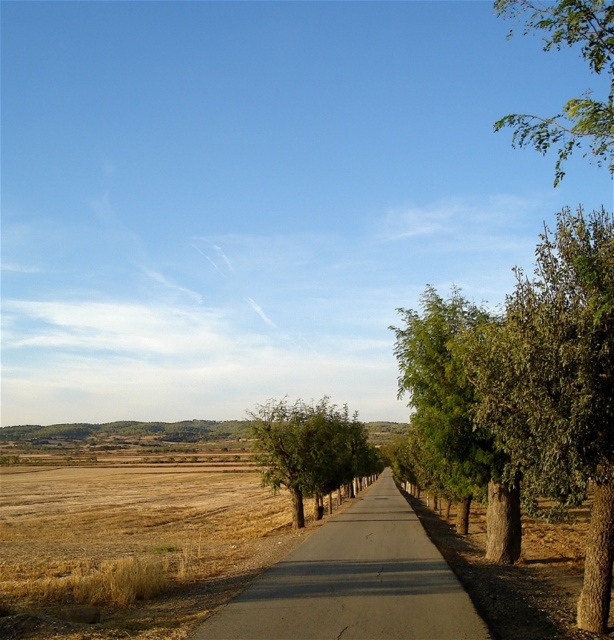
You are standing at the starting point of the road in the rural landscape. You see two points marked on the road ahead. The first point is at coordinates point (x=538, y=307) and the second point is at point (x=405, y=323). Which point is closer to you as you walk along the road?

Point (x=538, y=307) is in front of point (x=405, y=323), so the first point is closer to you as you walk along the road.